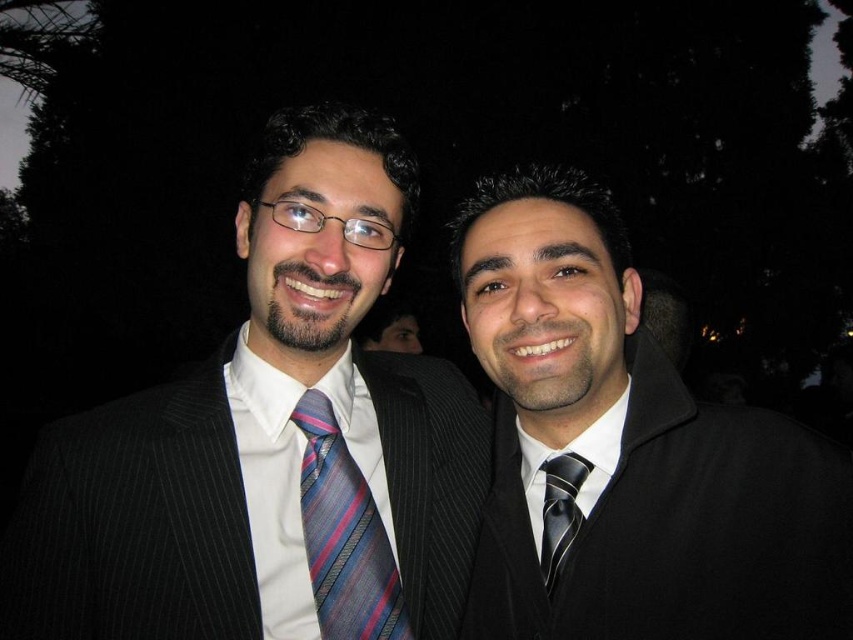
Question: Which point is farther from the camera taking this photo?

Choices:
 (A) (561, 484)
 (B) (334, 518)
 (C) (741, 426)

Answer: (A)

Question: Which object is positioned closest to the black silk suit at center?

Choices:
 (A) striped silk tie at center
 (B) black silk tie at center

Answer: (B)

Question: Considering the relative positions of striped silk tie at center and black silk tie at center in the image provided, where is striped silk tie at center located with respect to black silk tie at center?

Choices:
 (A) above
 (B) below

Answer: (A)

Question: Does matte black suit at left have a lesser width compared to black silk suit at center?

Choices:
 (A) yes
 (B) no

Answer: (B)

Question: Can you confirm if striped silk tie at center is positioned to the right of black silk tie at center?

Choices:
 (A) no
 (B) yes

Answer: (A)

Question: Which object is positioned closest to the black silk tie at center?

Choices:
 (A) black silk suit at center
 (B) striped silk tie at center
 (C) matte black suit at left

Answer: (A)